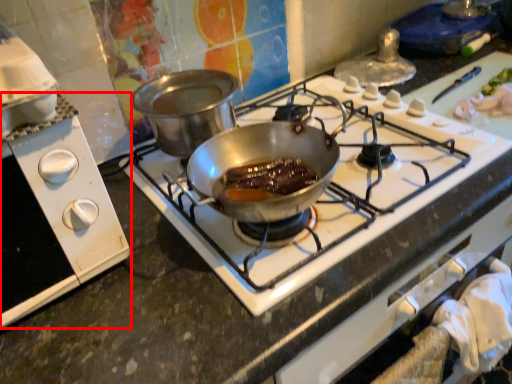
Question: In this image, where is kitchen appliance (annotated by the red box) located relative to gas stove?

Choices:
 (A) right
 (B) left

Answer: (B)